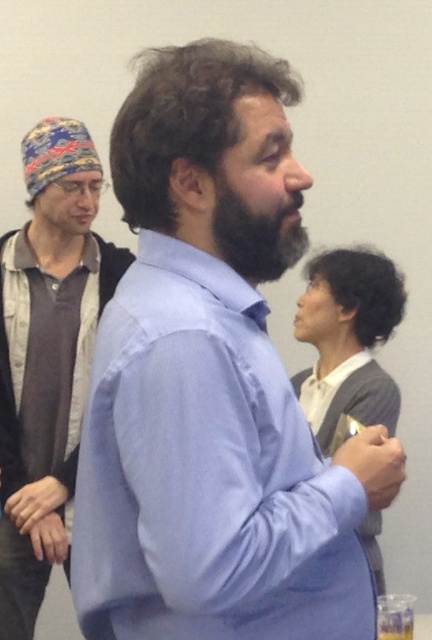
You are standing in the room where the three people are. You need to place a small sticker exactly at the point with coordinates point (213, 384). Which object should you place the sticker on?

The point (213, 384) is on the light blue shirt at center, so you should place the sticker on the light blue shirt at center.

You are taking a photo of a group of people standing against a white wall. The central person is wearing a light blue shirt. If the camera is set to focus on objects 36 inches away, will the light blue shirt at center be in focus?

The light blue shirt at center is 36.09 inches from the camera, which is very close to the 36 inches focus setting. Depending on the camera lens and depth of field, it might be slightly out of focus, but likely still sharp enough for most purposes.

You are organizing a clothing donation drive and need to categorize shirts by size. You have two shirts in front of you on a table, the light blue shirt at center and the matte blue shirt at center. Which shirt should you place in the large size bin?

The light blue shirt at center is larger in size than the matte blue shirt at center, so it should be placed in the large size bin.